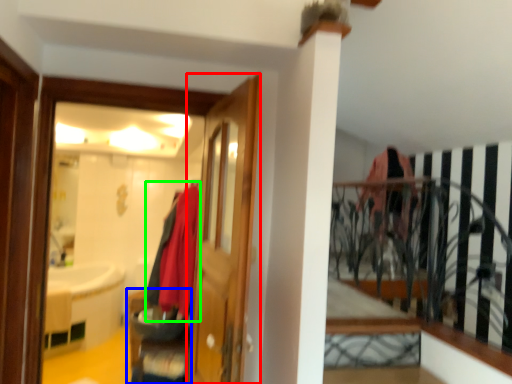
Question: Which is farther away from door (highlighted by a red box)? furniture (highlighted by a blue box) or clothing (highlighted by a green box)?

Choices:
 (A) furniture
 (B) clothing

Answer: (A)